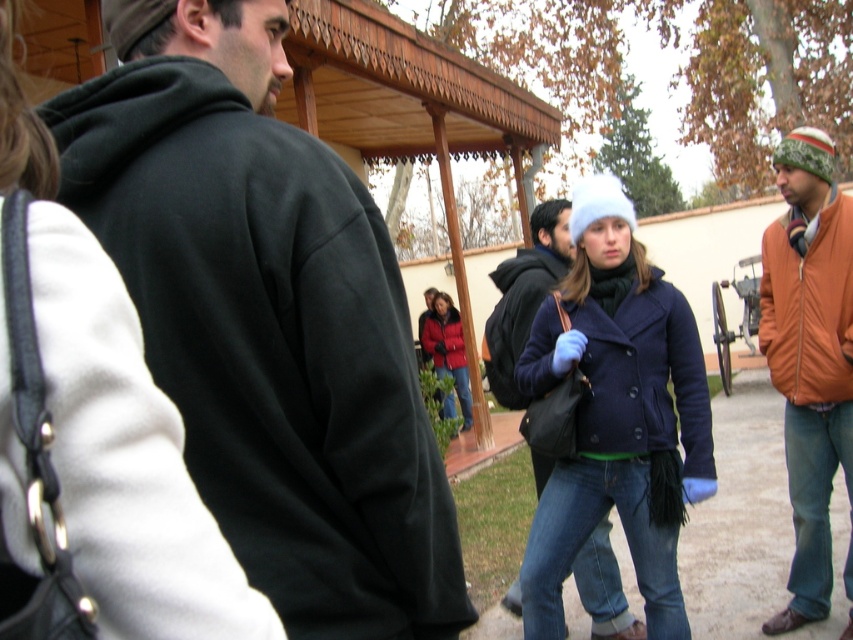
Between orange nylon jacket at right and matte red coat at center, which one has more height?

orange nylon jacket at right

Locate an element on the screen. This screenshot has width=853, height=640. orange nylon jacket at right is located at coordinates (809, 358).

Does point (786, 422) lie in front of point (450, 346)?

Yes, it is in front of point (450, 346).

Where is `orange nylon jacket at right`? orange nylon jacket at right is located at coordinates (809, 358).

Find the location of a particular element. The width and height of the screenshot is (853, 640). orange nylon jacket at right is located at coordinates (809, 358).

You are a GUI agent. You are given a task and a screenshot of the screen. Output one action in this format:
    pyautogui.click(x=<x>, y=<y>)
    Task: Click on the orange nylon jacket at right
    
    Given the screenshot: What is the action you would take?
    pyautogui.click(x=809, y=358)

Between point (506, 307) and point (456, 340), which one is positioned behind?

Positioned behind is point (456, 340).

Which is below, matte black jacket at center or matte red jacket at center?

matte red jacket at center

Between point (509, 340) and point (437, 296), which one is positioned in front?

Positioned in front is point (509, 340).

Image resolution: width=853 pixels, height=640 pixels. Find the location of `matte black jacket at center`. matte black jacket at center is located at coordinates (515, 316).